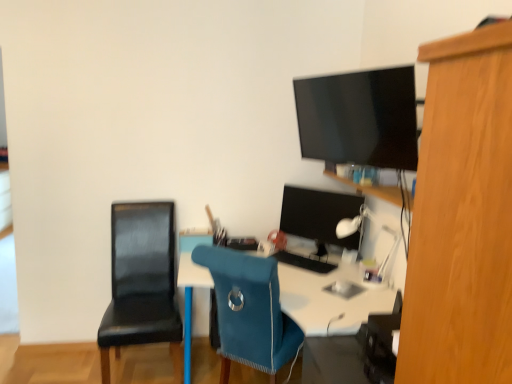
You are a GUI agent. You are given a task and a screenshot of the screen. Output one action in this format:
    pyautogui.click(x=<x>, y=<y>)
    Task: Click on the vacant space situated above white glossy desk at center (from a real-world perspective)
    This screenshot has height=384, width=512.
    Given the screenshot: What is the action you would take?
    pyautogui.click(x=312, y=284)